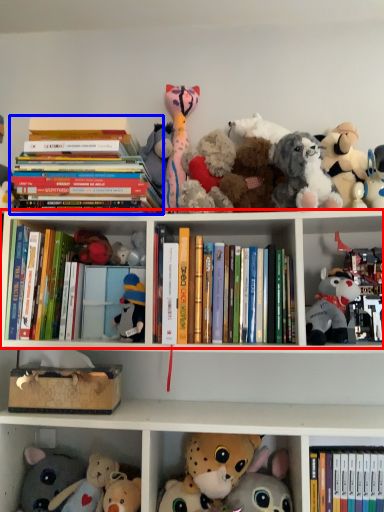
Question: Which point is closer to the camera, shelf (highlighted by a red box) or book (highlighted by a blue box)?

Choices:
 (A) shelf
 (B) book

Answer: (A)